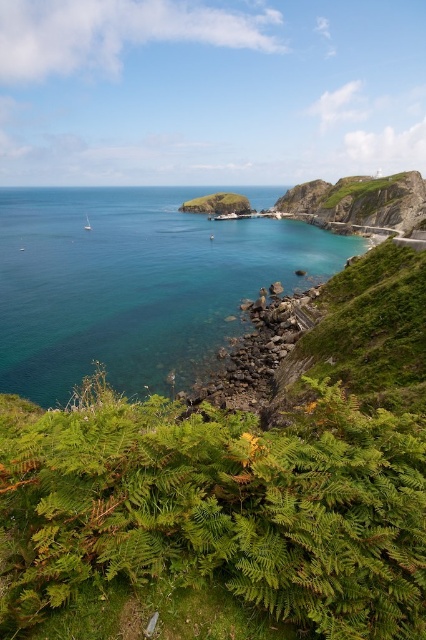
You are standing on the coast looking at the clear blue water at center and the green grassy hillside at upper right. Which object is nearer to you?

The clear blue water at center is closer to the viewer than the green grassy hillside at upper right.

In the scene shown: You are a hiker who wants to cross from the green grassy hillside at upper right to the clear blue water at center. Given that your average walking speed is 1.5 meters per second, how many seconds will it take you to reach the water if you walk directly towards it?

The distance between the green grassy hillside at upper right and clear blue water at center is 36.78 meters. At a walking speed of 1.5 meters per second, it would take approximately 24.52 seconds to reach the water.

You are standing at the coastal scene and want to walk from the point at the bottom left corner to the point at the top right corner. Which point should you reach first? The point at the bottom left corner is labeled as point (397,177), and the point at the top right corner is labeled as point (187,204). Please choose between them.

You should reach point (397,177) first because it is in front of point (187,204), meaning it is closer to your starting position at the bottom left corner.